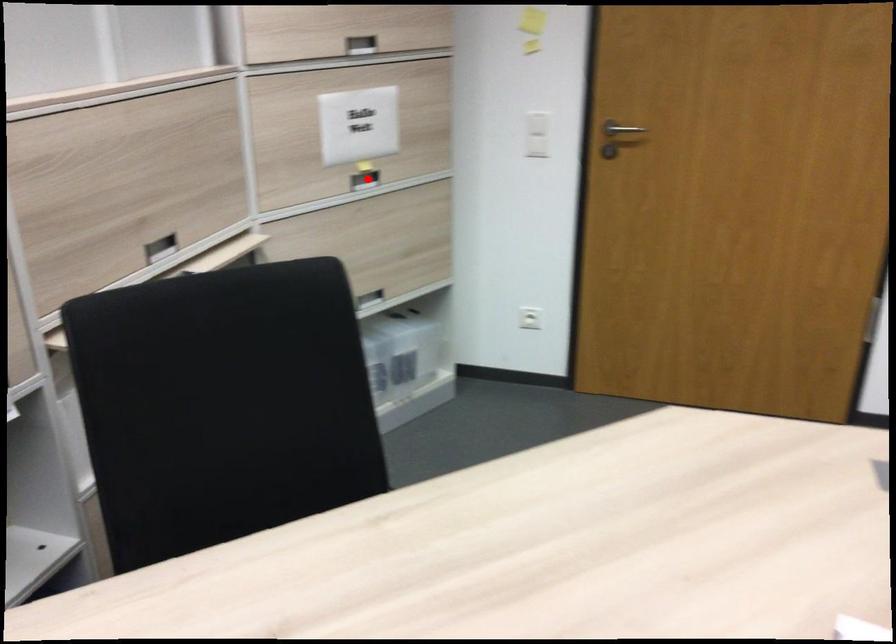
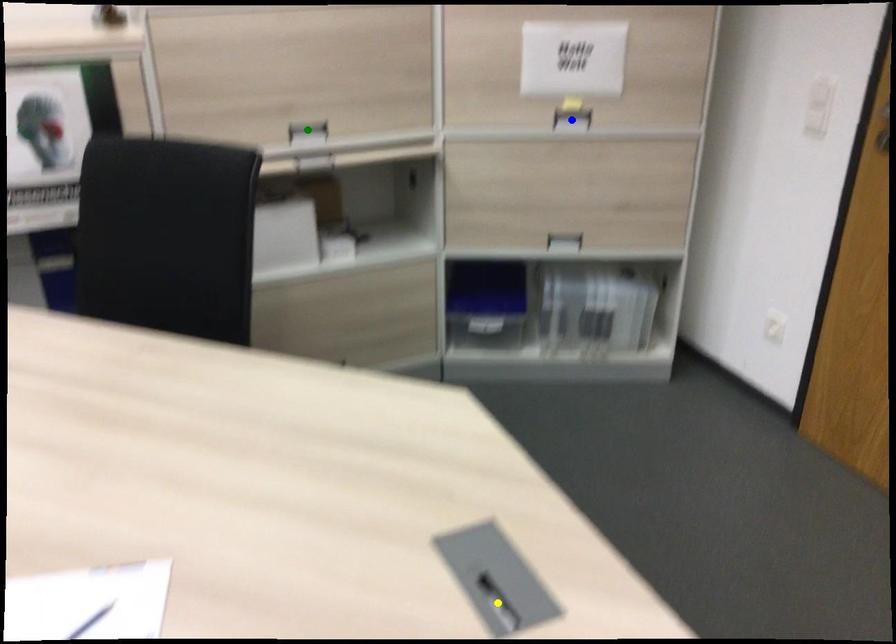
Question: I am providing you with two images of the same scene from different viewpoints. A red point is marked on the first image. You are given multiple points on the second image. Which point in image 2 represents the same 3d spot as the red point in image 1?

Choices:
 (A) green point
 (B) blue point
 (C) yellow point

Answer: (B)